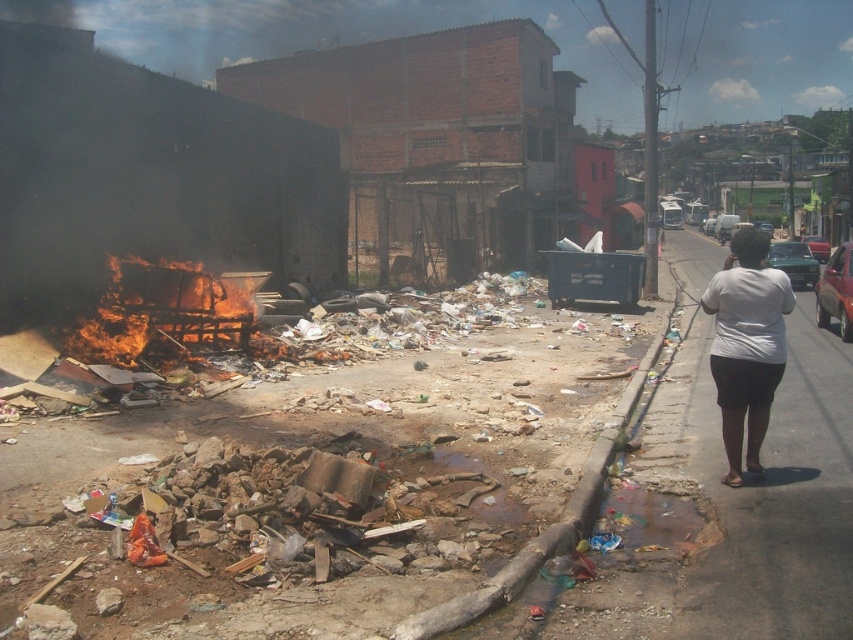
Is flaming wood at left positioned in front of brown concrete curb at lower center?

No, it is behind brown concrete curb at lower center.

Where is `flaming wood at left`? This screenshot has height=640, width=853. flaming wood at left is located at coordinates (163, 316).

Can you confirm if flaming wood at left is smaller than white cotton shirt at right?

Yes, flaming wood at left is smaller than white cotton shirt at right.

Does flaming wood at left have a greater width compared to white cotton shirt at right?

No, flaming wood at left is not wider than white cotton shirt at right.

Between point (103, 310) and point (749, 288), which one is positioned in front?

Positioned in front is point (749, 288).

Find the location of a particular element. The width and height of the screenshot is (853, 640). flaming wood at left is located at coordinates (163, 316).

Does white cotton shirt at right lie in front of brown concrete curb at lower center?

That is False.

You are a GUI agent. You are given a task and a screenshot of the screen. Output one action in this format:
    pyautogui.click(x=<x>, y=<y>)
    Task: Click on the white cotton shirt at right
    
    Given the screenshot: What is the action you would take?
    pyautogui.click(x=746, y=344)

Is point (749, 435) farther from camera compared to point (631, 406)?

No, it is in front of (631, 406).

Where is `white cotton shirt at right`? This screenshot has width=853, height=640. white cotton shirt at right is located at coordinates (746, 344).